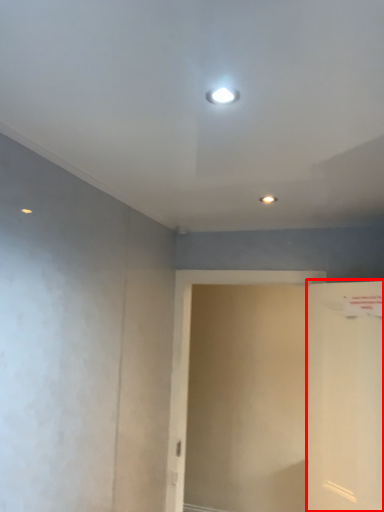
Question: Considering the relative positions of door (annotated by the red box) and screen door in the image provided, where is door (annotated by the red box) located with respect to the staircase?

Choices:
 (A) right
 (B) left

Answer: (A)